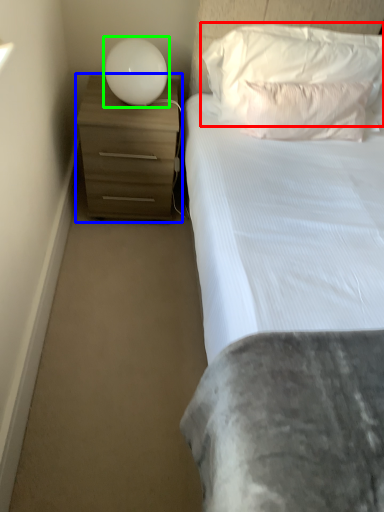
Question: Estimate the real-world distances between objects in this image. Which object is farther from pillow (highlighted by a red box), chest of drawers (highlighted by a blue box) or lamp (highlighted by a green box)?

Choices:
 (A) chest of drawers
 (B) lamp

Answer: (A)